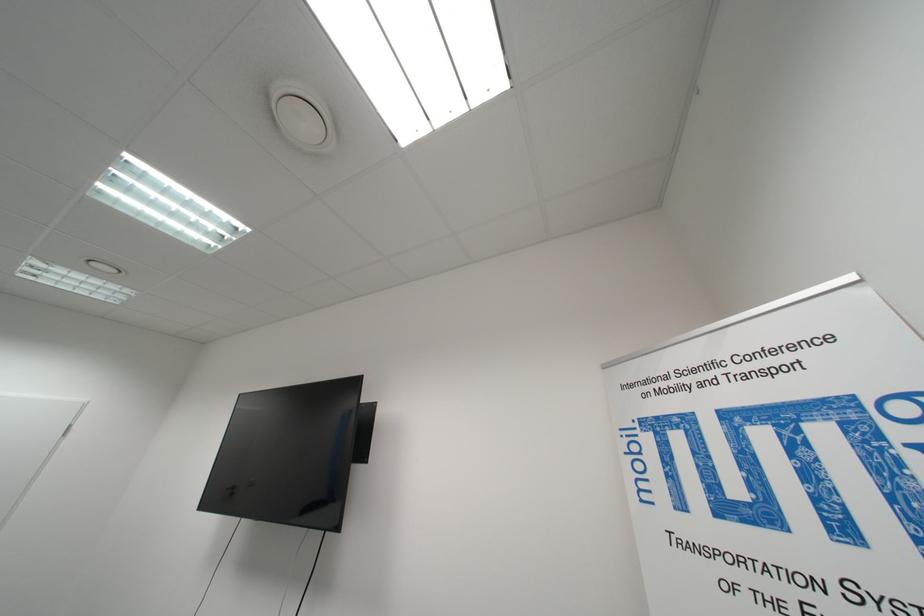
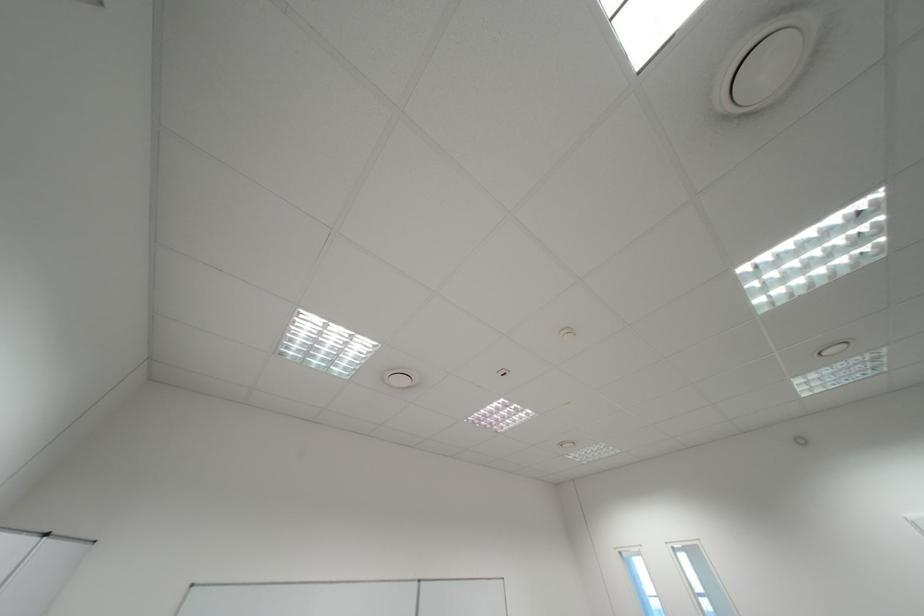
First-person continuous shooting, in which direction is the camera rotating?

The camera's rotation is toward left-up.